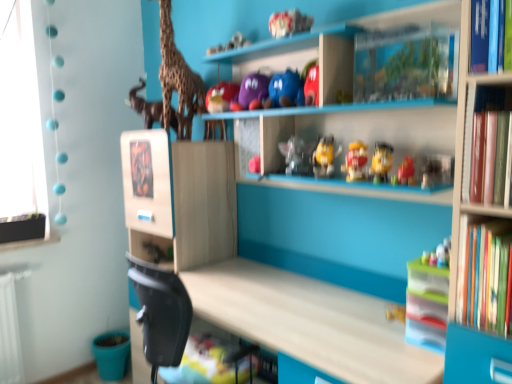
Question: In terms of width, does wooden giraffe at upper left look wider or thinner when compared to hardcover books at right?

Choices:
 (A) wide
 (B) thin

Answer: (A)

Question: In terms of size, does wooden giraffe at upper left appear bigger or smaller than hardcover books at right?

Choices:
 (A) small
 (B) big

Answer: (B)

Question: Considering the real-world distances, which object is closest to the translucent plastic toy at center, which ranks as the fifth toy in top-to-bottom order?

Choices:
 (A) wooden giraffe at upper left
 (B) matte purple plush at upper center, which appears as the first toy when viewed from the top
 (C) hardcover books at right
 (D) purple matte plush at upper center, acting as the 2th toy starting from the top
 (E) matte yellow toy at center, arranged as the sixth toy when viewed from the top

Answer: (E)

Question: Considering the real-world distances, which object is closest to the translucent plastic toy at center, the 2th toy in the bottom-to-top sequence?

Choices:
 (A) matte purple plush at upper center, which appears as the first toy when viewed from the top
 (B) hardcover books at right
 (C) yellow matte toy at center, which is counted as the third toy, starting from the bottom
 (D) matte brown elephant at upper left
 (E) wooden toy dinosaur at lower left

Answer: (C)